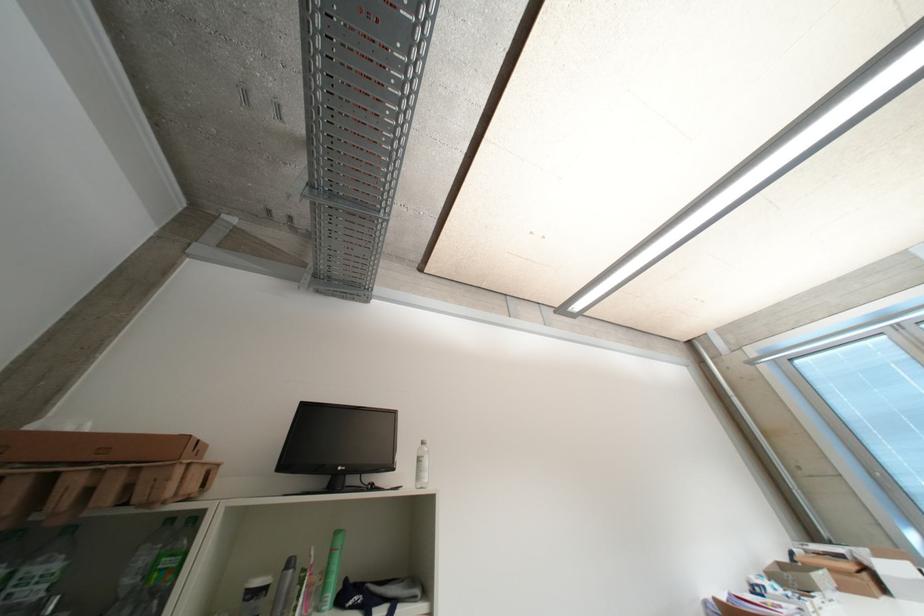
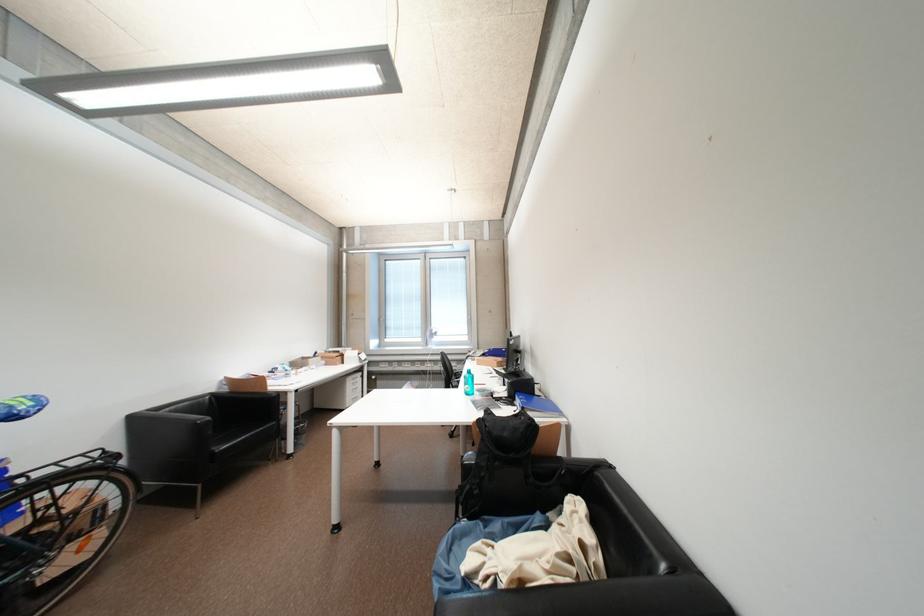
Where in the second image is the point corresponding to (893,463) from the first image?

(395, 315)